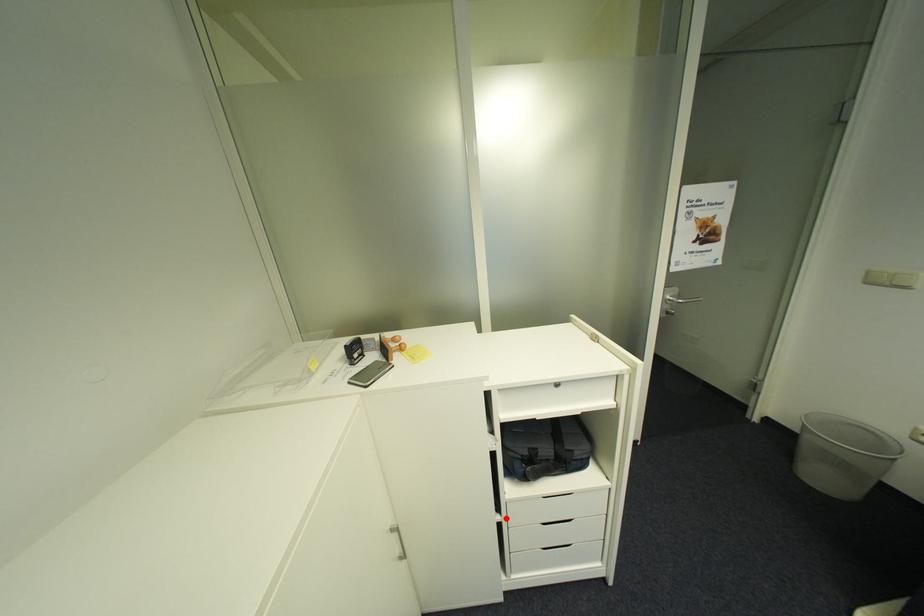
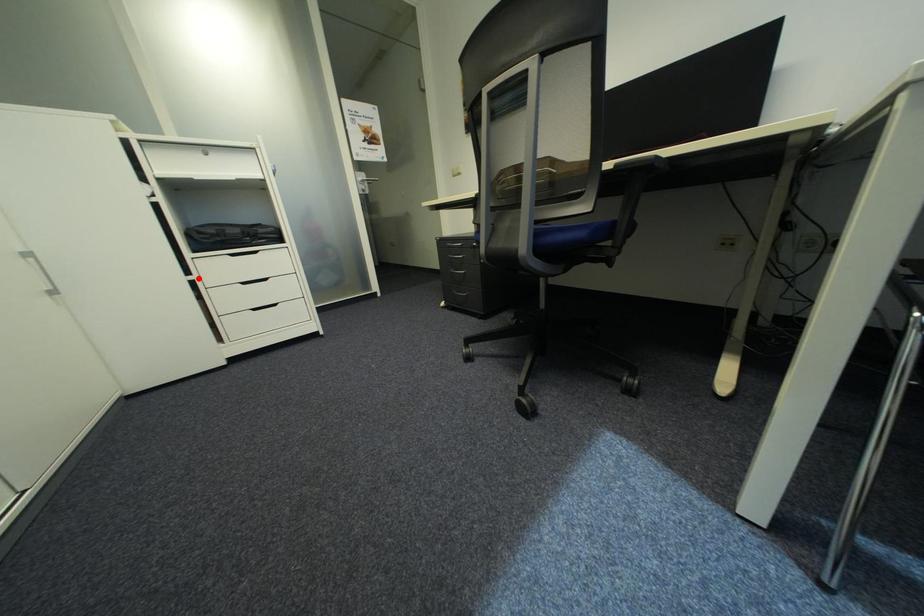
I am providing you with two images of the same scene from different viewpoints. A red point is marked on the first image and another point is marked on the second image. Is the red point in image1 aligned with the point shown in image2?

Yes